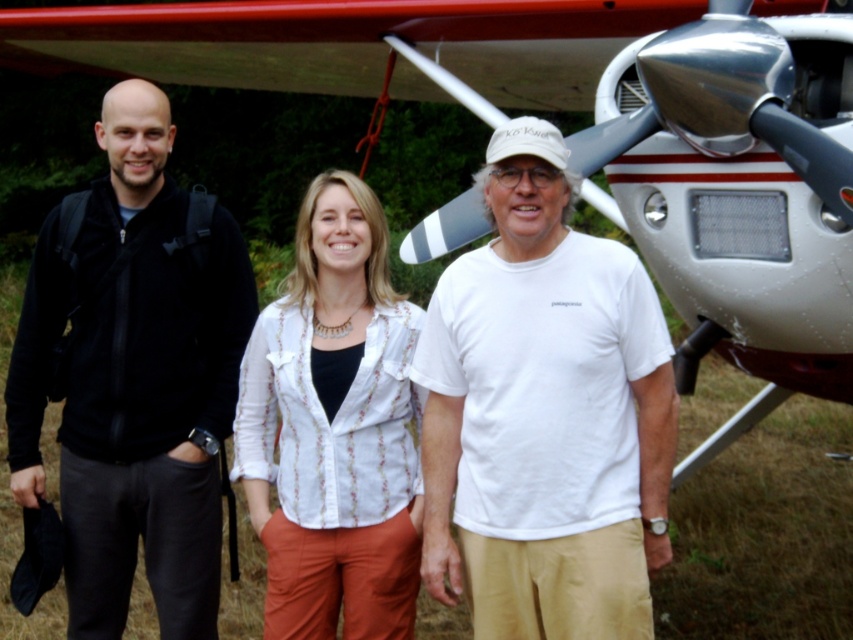
Question: Can you confirm if black fabric jacket at left is positioned to the right of white textured blouse at center?

Choices:
 (A) yes
 (B) no

Answer: (B)

Question: Which of the following is the farthest from the observer?

Choices:
 (A) white textured blouse at center
 (B) black fabric jacket at left

Answer: (B)

Question: Where is white cotton t-shirt at center located in relation to black fabric jacket at left in the image?

Choices:
 (A) above
 (B) below

Answer: (B)

Question: Which point appears farthest from the camera in this image?

Choices:
 (A) (329, 403)
 (B) (577, 625)
 (C) (119, 625)

Answer: (C)

Question: Can you confirm if white cotton t-shirt at center is smaller than black fabric jacket at left?

Choices:
 (A) no
 (B) yes

Answer: (B)

Question: Which point is closer to the camera taking this photo?

Choices:
 (A) (9, 381)
 (B) (314, 221)

Answer: (B)